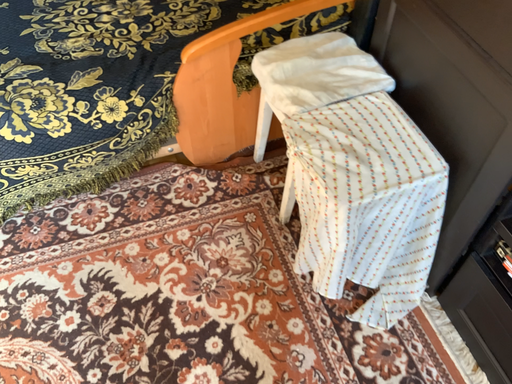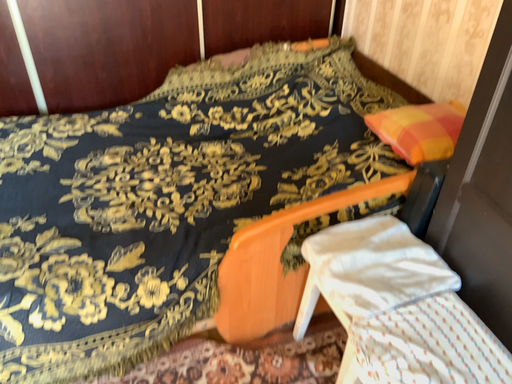
Question: How did the camera likely rotate when shooting the video?

Choices:
 (A) rotated downward
 (B) rotated upward

Answer: (B)